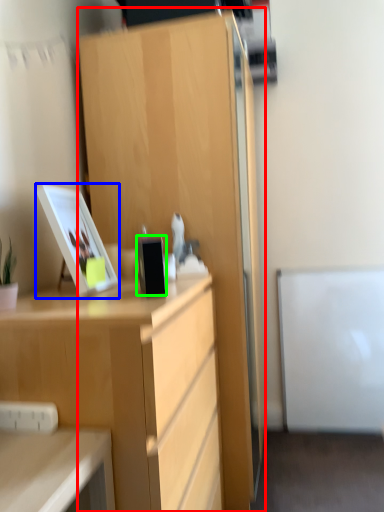
Question: Estimate the real-world distances between objects in this image. Which object is farther from cabinetry (highlighted by a red box), picture frame (highlighted by a blue box) or appliance (highlighted by a green box)?

Choices:
 (A) picture frame
 (B) appliance

Answer: (B)